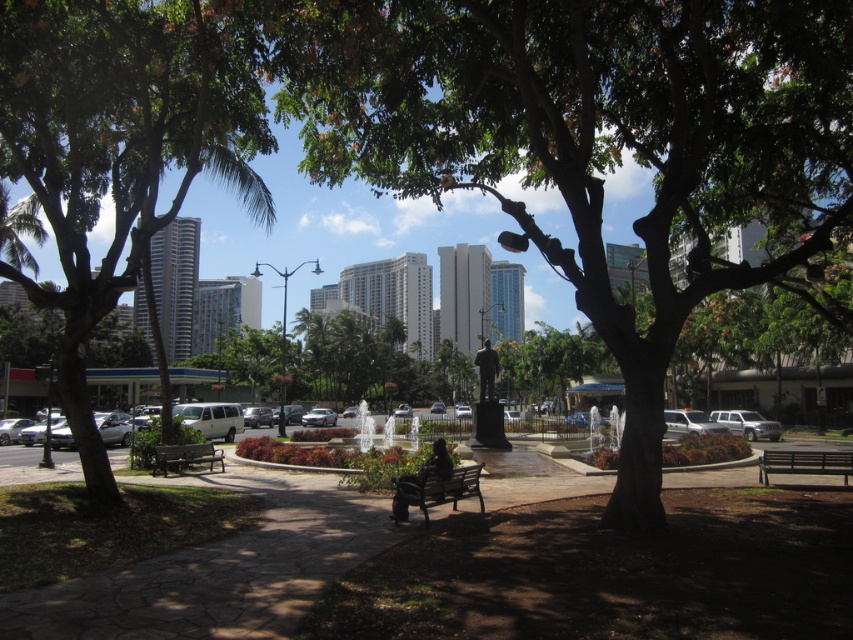
Which is more to the left, green leafy tree at left or dark brown wooden bench at lower left?

green leafy tree at left

Is point (105, 260) positioned behind point (219, 456)?

No, (105, 260) is in front of (219, 456).

Locate an element on the screen. This screenshot has width=853, height=640. green leafy tree at left is located at coordinates (117, 148).

Does dark brown textured tree at center appear under dark brown wooden bench at lower left?

No.

Who is more forward, (825, 248) or (173, 460)?

Point (825, 248)

Locate an element on the screen. The height and width of the screenshot is (640, 853). dark brown textured tree at center is located at coordinates (595, 140).

Is dark brown textured tree at center thinner than green leafy tree at left?

Indeed, dark brown textured tree at center has a lesser width compared to green leafy tree at left.

Is dark brown textured tree at center further to the viewer compared to green leafy tree at left?

No.

Where is `dark brown textured tree at center`? Image resolution: width=853 pixels, height=640 pixels. dark brown textured tree at center is located at coordinates (595, 140).